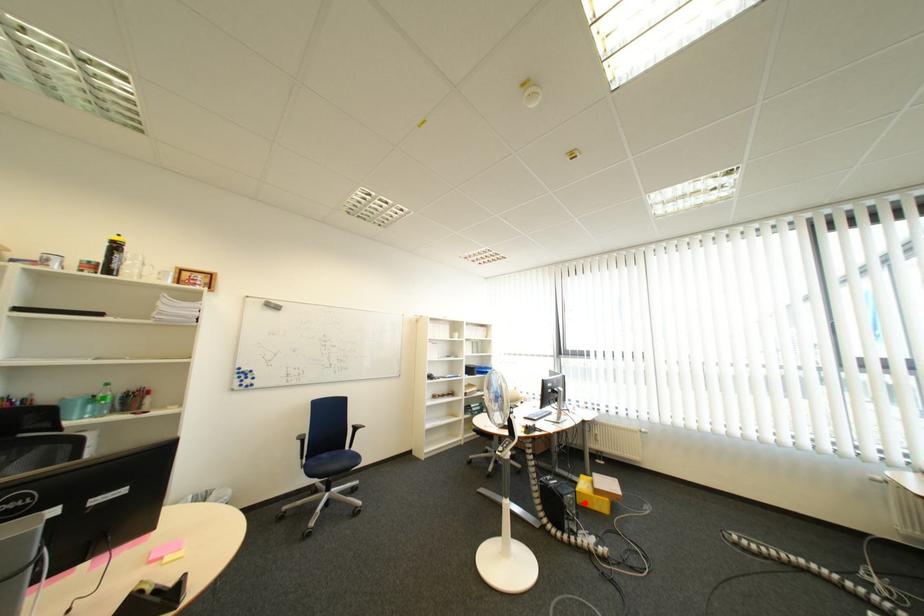
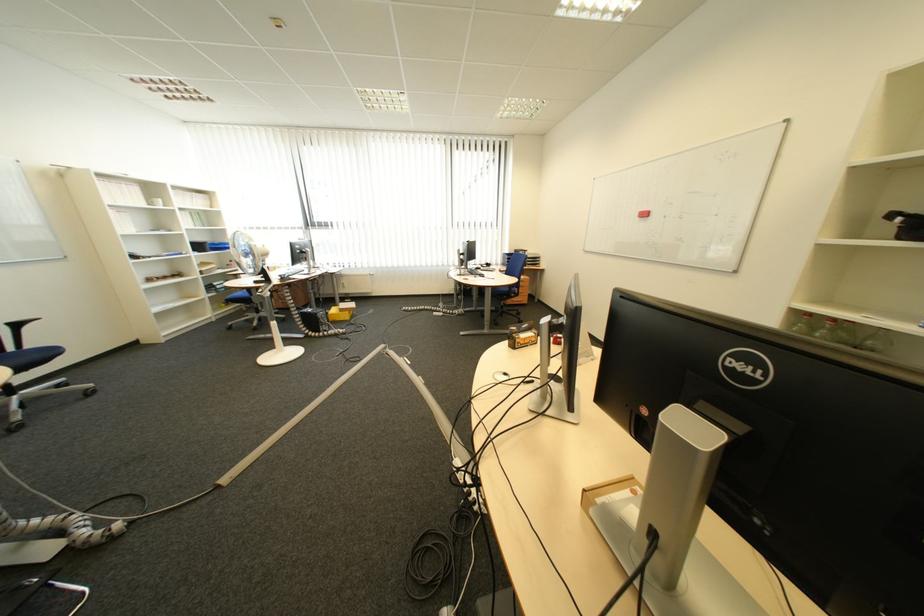
Question: I am providing you with two images of the same scene from different viewpoints. Image1 has a red point marked. In image2, the corresponding 3D location appears at what relative position? Reply with the corresponding letter.

Choices:
 (A) Closer
 (B) Farther

Answer: (A)